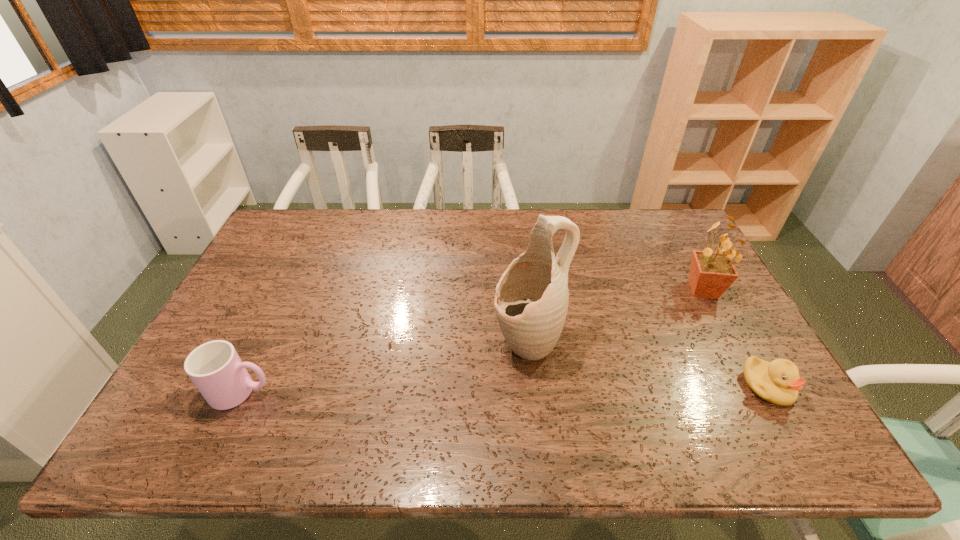
The width and height of the screenshot is (960, 540). I want to click on free space on the desktop that is between the leftmost object and the duckling and is positioned at the front of the farthest object with flowers visible, so click(567, 388).

Locate an element on the screen. The height and width of the screenshot is (540, 960). free space on the desktop that is between the leftmost object and the duckling and is positioned at the spout of the pitcher is located at coordinates (432, 390).